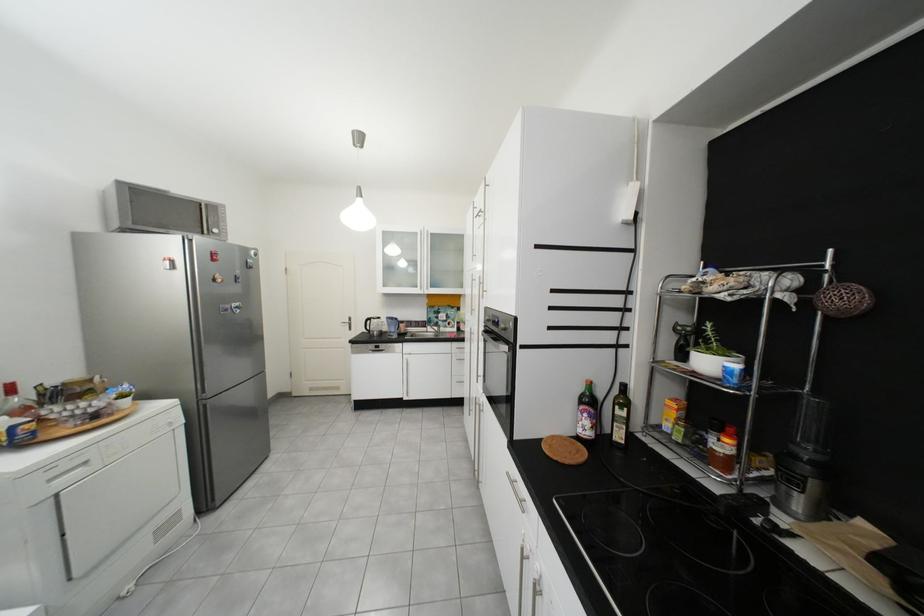
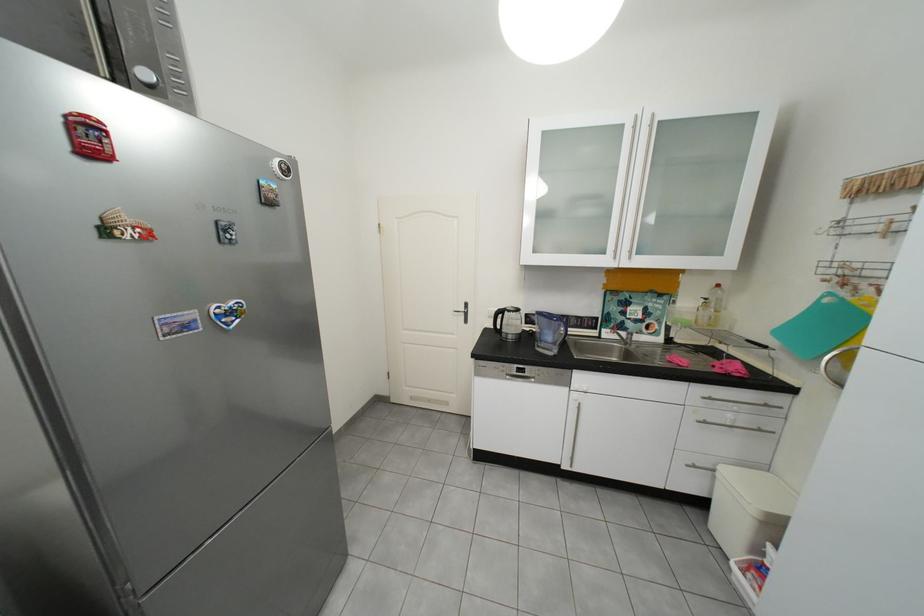
In the second image, find the point that corresponds to pixel 405 331 in the first image.

(561, 339)